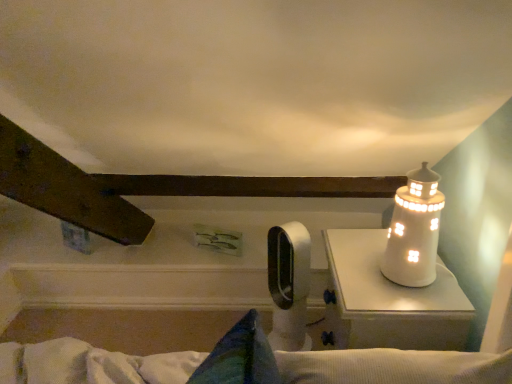
Question: From their relative heights in the image, would you say white plastic fan at center is taller or shorter than white glossy lighthouse at right?

Choices:
 (A) short
 (B) tall

Answer: (B)

Question: Is white plastic fan at center wider or thinner than white glossy lighthouse at right?

Choices:
 (A) thin
 (B) wide

Answer: (A)

Question: Considering the real-world distances, which object is closest to the white glossy lighthouse at right?

Choices:
 (A) white ceramic lighthouse at upper right
 (B) white plastic fan at center

Answer: (A)

Question: Which object is the closest to the white ceramic lighthouse at upper right?

Choices:
 (A) white glossy lighthouse at right
 (B) white plastic fan at center

Answer: (A)